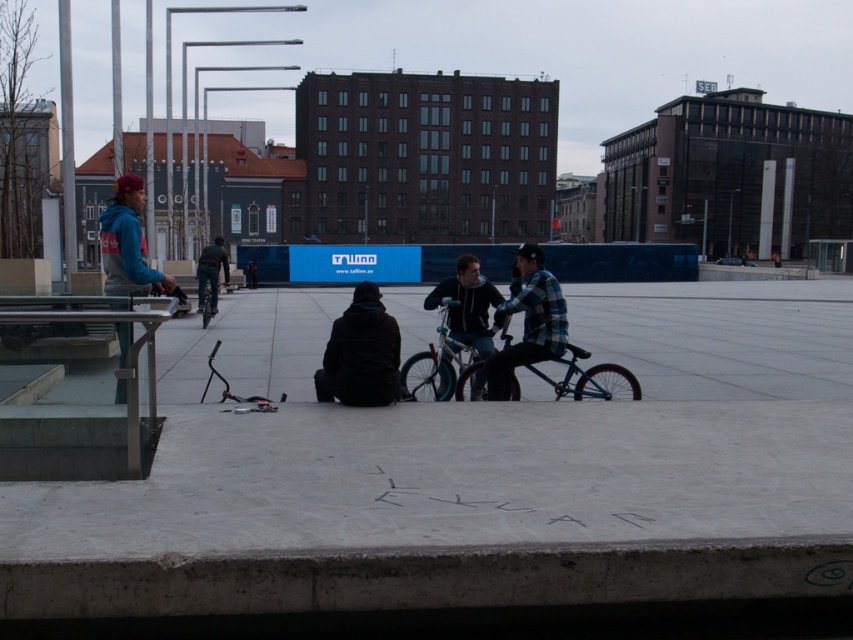
Question: Which point is farther to the camera?

Choices:
 (A) dark blue jeans at center
 (B) blue matte bicycle at center

Answer: (A)

Question: Which point is farther from the camera taking this photo?

Choices:
 (A) (112, 291)
 (B) (602, 372)

Answer: (B)

Question: Does blue fleece jacket at left have a smaller size compared to dark gray hoodie at center?

Choices:
 (A) no
 (B) yes

Answer: (B)

Question: Which object appears closest to the camera in this image?

Choices:
 (A) dark blue jeans at center
 (B) blue metallic bicycle at center
 (C) blue fleece jacket at left
 (D) blue matte bicycle at center

Answer: (C)

Question: Is plaid flannel shirt at center above blue metallic bicycle at center?

Choices:
 (A) yes
 (B) no

Answer: (B)

Question: Does black matte jacket at center have a greater width compared to dark blue jeans at center?

Choices:
 (A) yes
 (B) no

Answer: (B)